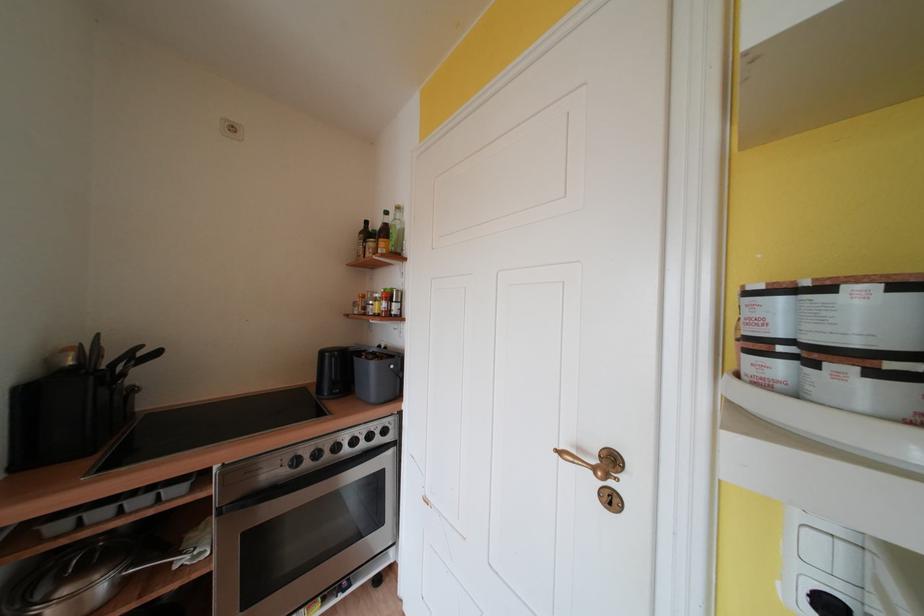
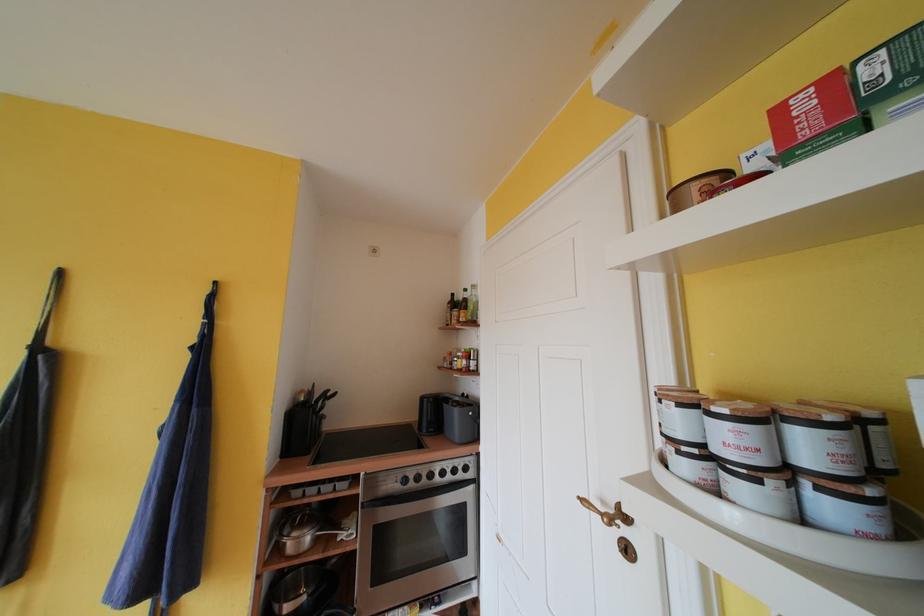
Question: The images are taken continuously from a first-person perspective. In which direction is your viewpoint rotating?

Choices:
 (A) Left
 (B) Right
 (C) Up
 (D) Down

Answer: (A)